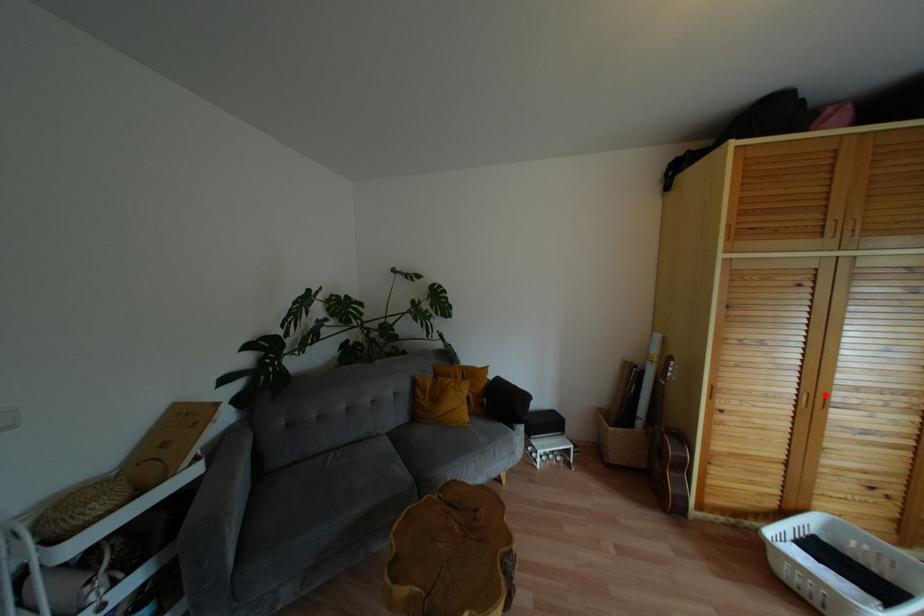
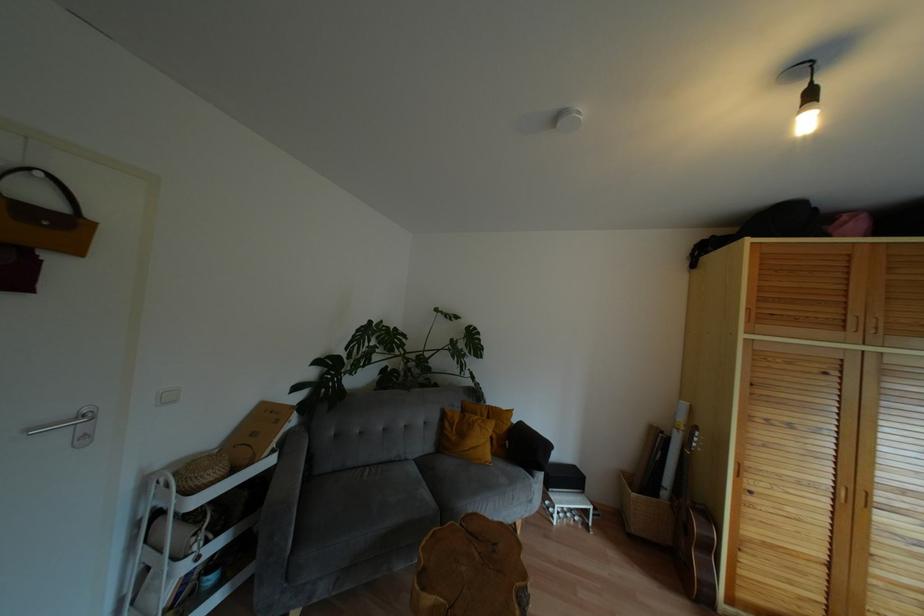
Where in the second image is the point corresponding to the highlighted location from the first image?

(867, 493)